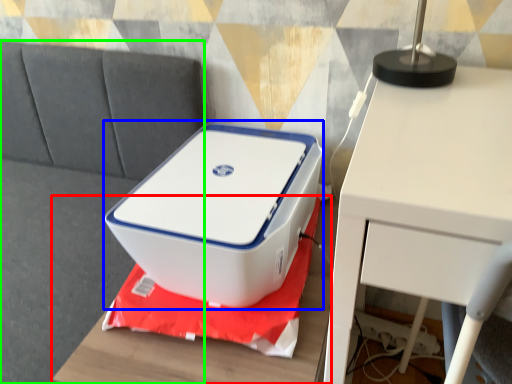
Question: Which is nearer to the furniture (highlighted by a red box)? storage box (highlighted by a blue box) or couch (highlighted by a green box).

Choices:
 (A) storage box
 (B) couch

Answer: (A)